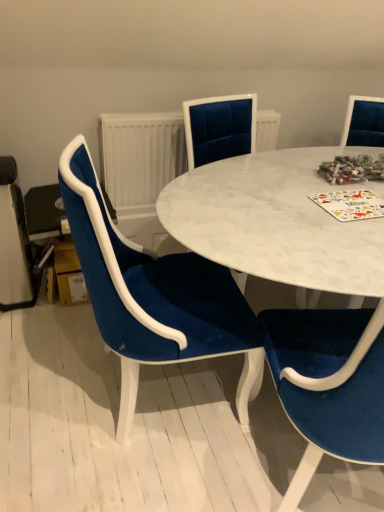
The width and height of the screenshot is (384, 512). What do you see at coordinates (154, 295) in the screenshot? I see `velvet blue chair at left, which appears as the second chair when viewed from the right` at bounding box center [154, 295].

Describe the element at coordinates (140, 157) in the screenshot. I see `white textured radiator at center` at that location.

The image size is (384, 512). I want to click on white textured radiator at center, so click(x=140, y=157).

At what (x,y) coordinates should I click in order to perform the action: click on multicolored paper at center. Please return your answer as a coordinate pair (x, y). The image size is (384, 512). Looking at the image, I should click on (350, 204).

I want to click on velvet blue chair at center, which is the 1th chair in right-to-left order, so click(329, 384).

This screenshot has height=512, width=384. In order to click on velvet blue chair at left, which is the first chair in left-to-right order in this screenshot , I will do `click(154, 295)`.

Can you confirm if white marble table at center is smaller than velvet blue chair at center, which is the 1th chair in right-to-left order?

Correct, white marble table at center occupies less space than velvet blue chair at center, which is the 1th chair in right-to-left order.

Is white marble table at center taller than velvet blue chair at center, which is the 1th chair in right-to-left order?

Correct, white marble table at center is much taller as velvet blue chair at center, which is the 1th chair in right-to-left order.

From a real-world perspective, is white marble table at center positioned above or below velvet blue chair at center, marked as the 2th chair in a left-to-right arrangement?

Clearly, from a real-world perspective, white marble table at center is above velvet blue chair at center, marked as the 2th chair in a left-to-right arrangement.

Is velvet blue chair at center, which is the 1th chair in right-to-left order, positioned with its back to velvet blue chair at left, which appears as the second chair when viewed from the right?

No, velvet blue chair at center, which is the 1th chair in right-to-left order, is not facing the opposite direction of velvet blue chair at left, which appears as the second chair when viewed from the right.

Can you see velvet blue chair at center, marked as the 2th chair in a left-to-right arrangement, touching velvet blue chair at left, which appears as the second chair when viewed from the right?

velvet blue chair at center, marked as the 2th chair in a left-to-right arrangement, and velvet blue chair at left, which appears as the second chair when viewed from the right, are not in contact.

You are a GUI agent. You are given a task and a screenshot of the screen. Output one action in this format:
    pyautogui.click(x=<x>, y=<y>)
    Task: Click on the chair above the velvet blue chair at center, which is the 1th chair in right-to-left order (from a real-world perspective)
    Image resolution: width=384 pixels, height=512 pixels.
    Given the screenshot: What is the action you would take?
    pyautogui.click(x=154, y=295)

From a real-world perspective, between velvet blue chair at center, marked as the 2th chair in a left-to-right arrangement, and velvet blue chair at left, which appears as the second chair when viewed from the right, who is vertically lower?

velvet blue chair at center, marked as the 2th chair in a left-to-right arrangement, from a real-world perspective.

Is white textured radiator at center to the right of multicolored paper at center from the viewer's perspective?

Incorrect, white textured radiator at center is not on the right side of multicolored paper at center.

Are white textured radiator at center and multicolored paper at center located far from each other?

No, white textured radiator at center is not far from multicolored paper at center.

From the image's perspective, is white textured radiator at center beneath multicolored paper at center?

No.

Between white textured radiator at center and multicolored paper at center, which one is positioned in front?

multicolored paper at center is closer to the camera.

Can you confirm if multicolored paper at center is thinner than velvet blue chair at center, marked as the 2th chair in a left-to-right arrangement?

Yes, multicolored paper at center is thinner than velvet blue chair at center, marked as the 2th chair in a left-to-right arrangement.

Which object is further away from the camera taking this photo, multicolored paper at center or velvet blue chair at center, which is the 1th chair in right-to-left order?

multicolored paper at center is further from the camera.

Is multicolored paper at center located outside velvet blue chair at center, marked as the 2th chair in a left-to-right arrangement?

Yes.

Is multicolored paper at center not close to velvet blue chair at center, marked as the 2th chair in a left-to-right arrangement?

No, there isn't a large distance between multicolored paper at center and velvet blue chair at center, marked as the 2th chair in a left-to-right arrangement.

From a real-world perspective, relative to white textured radiator at center, is velvet blue chair at left, which is the first chair in left-to-right order, vertically above or below?

Clearly, from a real-world perspective, velvet blue chair at left, which is the first chair in left-to-right order, is below white textured radiator at center.

Is velvet blue chair at left, which is the first chair in left-to-right order, not inside white textured radiator at center?

Yes, velvet blue chair at left, which is the first chair in left-to-right order, is not within white textured radiator at center.

From the image's perspective, is velvet blue chair at left, which is the first chair in left-to-right order, above white textured radiator at center?

No, from the image's perspective, velvet blue chair at left, which is the first chair in left-to-right order, is not over white textured radiator at center.

How many degrees apart are the facing directions of velvet blue chair at left, which is the first chair in left-to-right order, and white textured radiator at center?

The facing directions of velvet blue chair at left, which is the first chair in left-to-right order, and white textured radiator at center are 91.9 degrees apart.

Is white textured radiator at center shorter than velvet blue chair at center, which is the 1th chair in right-to-left order?

Yes, white textured radiator at center is shorter than velvet blue chair at center, which is the 1th chair in right-to-left order.

From a real-world perspective, which object stands above the other?

In real-world perspective, white textured radiator at center is above.

Could you tell me if white textured radiator at center is facing velvet blue chair at center, marked as the 2th chair in a left-to-right arrangement?

Yes.

Can you confirm if white textured radiator at center is thinner than velvet blue chair at center, marked as the 2th chair in a left-to-right arrangement?

Correct, the width of white textured radiator at center is less than that of velvet blue chair at center, marked as the 2th chair in a left-to-right arrangement.

Is white textured radiator at center behind white marble table at center?

Yes, white textured radiator at center is further from the camera.

Which of these two, white textured radiator at center or white marble table at center, stands taller?

white marble table at center.

From the image's perspective, relative to white marble table at center, is white textured radiator at center above or below?

Based on their image positions, white textured radiator at center is located above white marble table at center.

Are white textured radiator at center and white marble table at center beside each other?

No, white textured radiator at center is not next to white marble table at center.

You are a GUI agent. You are given a task and a screenshot of the screen. Output one action in this format:
    pyautogui.click(x=<x>, y=<y>)
    Task: Click on the chair that is the 2nd object located below the white marble table at center (from the image's perspective)
    This screenshot has width=384, height=512.
    Given the screenshot: What is the action you would take?
    pyautogui.click(x=329, y=384)

The height and width of the screenshot is (512, 384). Identify the location of chair above the velvet blue chair at center, marked as the 2th chair in a left-to-right arrangement (from a real-world perspective). (154, 295).

Based on their spatial positions, is white textured radiator at center or velvet blue chair at center, which is the 1th chair in right-to-left order, closer to white marble table at center?

Among the two, velvet blue chair at center, which is the 1th chair in right-to-left order, is located nearer to white marble table at center.

Considering their positions, is multicolored paper at center positioned closer to velvet blue chair at left, which appears as the second chair when viewed from the right, than white textured radiator at center?

multicolored paper at center is positioned closer to the anchor velvet blue chair at left, which appears as the second chair when viewed from the right.

Estimate the real-world distances between objects in this image. Which object is further from velvet blue chair at center, which is the 1th chair in right-to-left order, white marble table at center or velvet blue chair at left, which appears as the second chair when viewed from the right?

The object further to velvet blue chair at center, which is the 1th chair in right-to-left order, is white marble table at center.

Looking at the image, which one is located closer to velvet blue chair at left, which appears as the second chair when viewed from the right, velvet blue chair at center, marked as the 2th chair in a left-to-right arrangement, or white marble table at center?

white marble table at center.

Estimate the real-world distances between objects in this image. Which object is further from white marble table at center, multicolored paper at center or velvet blue chair at left, which is the first chair in left-to-right order?

velvet blue chair at left, which is the first chair in left-to-right order, is further to white marble table at center.

From the image, which object appears to be farther from velvet blue chair at center, which is the 1th chair in right-to-left order, velvet blue chair at left, which is the first chair in left-to-right order, or white marble table at center?

white marble table at center lies further to velvet blue chair at center, which is the 1th chair in right-to-left order, than the other object.

Considering their positions, is velvet blue chair at center, marked as the 2th chair in a left-to-right arrangement, positioned further to white textured radiator at center than white marble table at center?

velvet blue chair at center, marked as the 2th chair in a left-to-right arrangement, lies further to white textured radiator at center than the other object.

From the picture: Considering their positions, is white marble table at center positioned further to white textured radiator at center than velvet blue chair at left, which appears as the second chair when viewed from the right?

Among the two, velvet blue chair at left, which appears as the second chair when viewed from the right, is located further to white textured radiator at center.

Find the location of a particular element. This screenshot has height=512, width=384. chair located between velvet blue chair at center, which is the 1th chair in right-to-left order, and white marble table at center in the depth direction is located at coordinates [x=154, y=295].

This screenshot has width=384, height=512. Find the location of `table between velvet blue chair at left, which is the first chair in left-to-right order, and white textured radiator at center, along the z-axis`. table between velvet blue chair at left, which is the first chair in left-to-right order, and white textured radiator at center, along the z-axis is located at coordinates (277, 221).

Where is `card game between velvet blue chair at left, which appears as the second chair when viewed from the right, and white textured radiator at center in the front-back direction`? The image size is (384, 512). card game between velvet blue chair at left, which appears as the second chair when viewed from the right, and white textured radiator at center in the front-back direction is located at coordinates (350, 204).

I want to click on table situated between velvet blue chair at left, which appears as the second chair when viewed from the right, and multicolored paper at center from left to right, so click(x=277, y=221).